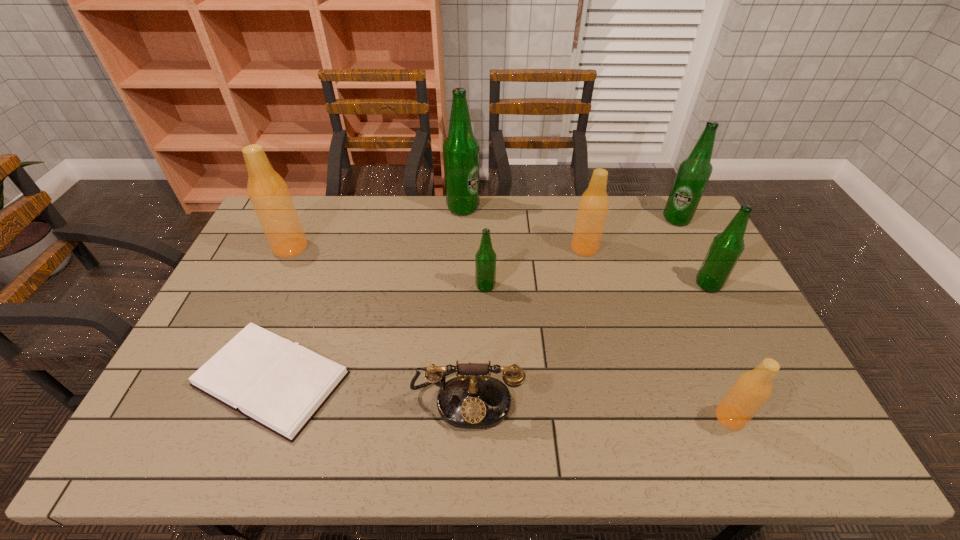
Where is `the smallest tan beer bottle`? the smallest tan beer bottle is located at coordinates (751, 390).

Find the location of a particular element. The width and height of the screenshot is (960, 540). black telephone is located at coordinates (473, 400).

Identify the location of the eighth tallest object. click(473, 400).

At what (x,y) coordinates should I click in order to perform the action: click on the shortest object. Please return your answer as a coordinate pair (x, y). Looking at the image, I should click on (280, 385).

Where is `brown hardback book`? Image resolution: width=960 pixels, height=540 pixels. brown hardback book is located at coordinates (280, 385).

Locate an element on the screen. vacant space located 0.380m on the label of the tallest object is located at coordinates (579, 208).

Find the location of a particular element. vacant space located 0.270m on the label of the third smallest green beer bottle is located at coordinates (708, 281).

This screenshot has width=960, height=540. I want to click on free spot located on the back of the leftmost tan beer bottle, so click(309, 206).

Find the location of `vacant space situated on the label of the second smallest green beer bottle`. vacant space situated on the label of the second smallest green beer bottle is located at coordinates (606, 285).

Locate an element on the screen. The image size is (960, 540). free location located on the label of the second smallest green beer bottle is located at coordinates (593, 285).